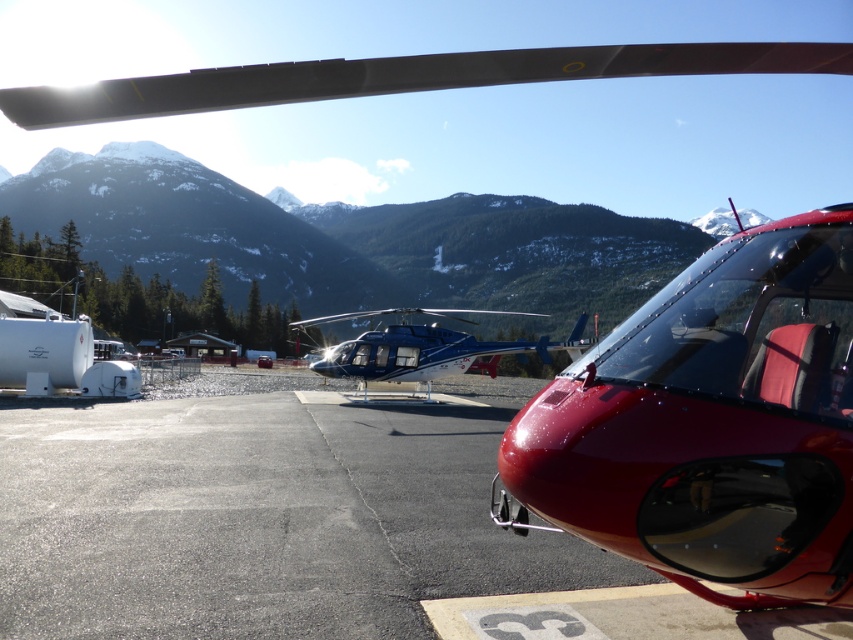
Question: Is smooth asphalt tarmac at center wider than shiny red helicopter at center?

Choices:
 (A) no
 (B) yes

Answer: (B)

Question: Considering the real-world distances, which object is closest to the snowy forested mountain at upper center?

Choices:
 (A) metallic blue helicopter at center
 (B) smooth asphalt tarmac at center

Answer: (A)

Question: Estimate the real-world distances between objects in this image. Which object is farther from the shiny red helicopter at center?

Choices:
 (A) metallic blue helicopter at center
 (B) smooth asphalt tarmac at center
 (C) snowy forested mountain at upper center

Answer: (C)

Question: Can you confirm if snowy forested mountain at upper center is smaller than metallic blue helicopter at center?

Choices:
 (A) yes
 (B) no

Answer: (B)

Question: Which point is farther to the camera?

Choices:
 (A) (3, 451)
 (B) (312, 364)
 (C) (500, 515)

Answer: (B)

Question: Does snowy forested mountain at upper center lie in front of metallic blue helicopter at center?

Choices:
 (A) yes
 (B) no

Answer: (B)